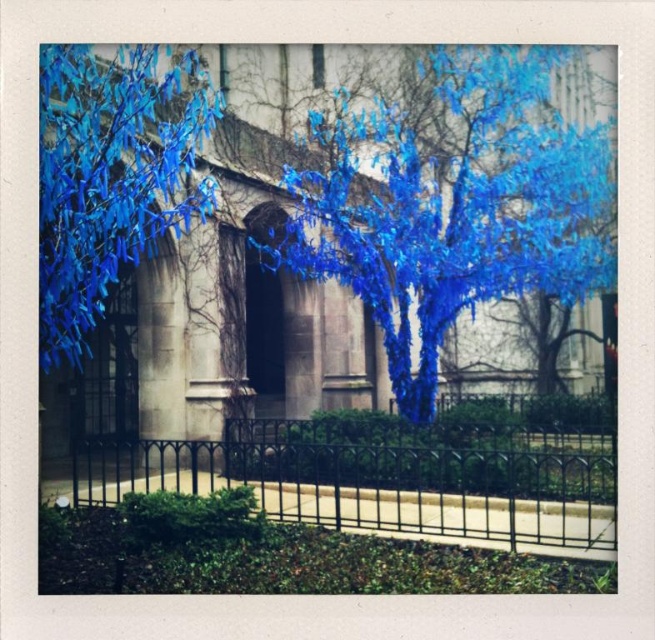
Consider the image. You are standing in front of the classical building and want to walk to the tree with blue decorations. Which object, the black wrought iron fence at center or the blue glossy leaves at upper left, will you encounter first?

The black wrought iron fence at center is closer to you than the blue glossy leaves at upper left, so you will encounter the black wrought iron fence at center first.

In the scene shown: You are standing at the center of the image. Which direction should you move to get closer to the blue glossy tree at center?

The blue glossy tree at center is already at the center of the image, so you don not need to move in any direction to get closer.

You are a painter standing at the base of the tree with a 2.5 meter long ladder. You need to paint both the black wrought iron fence at center and the blue glossy leaves at upper left. Can your ladder reach both areas without moving it?

The black wrought iron fence at center and blue glossy leaves at upper left are 4.81 meters apart. Since the ladder is only 2.5 meters long, it cannot span the distance between them. You will need to move the ladder to reach both areas.